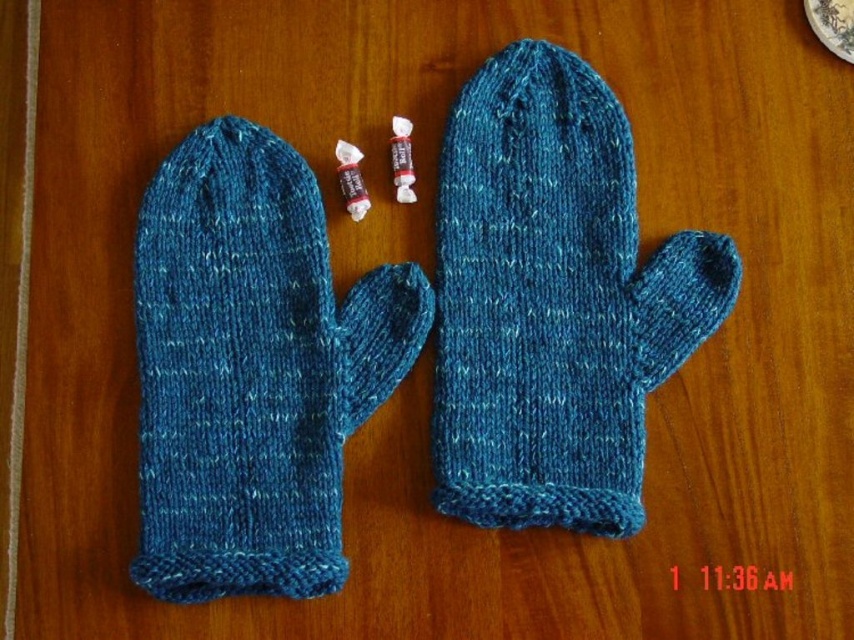
In the scene shown: Does teal knitted mitten at center have a lesser height compared to blue knitted mitten at left?

Incorrect, teal knitted mitten at center's height does not fall short of blue knitted mitten at left's.

Find the location of a particular element. teal knitted mitten at center is located at coordinates (553, 300).

The width and height of the screenshot is (854, 640). Describe the element at coordinates (553, 300) in the screenshot. I see `teal knitted mitten at center` at that location.

What are the coordinates of `teal knitted mitten at center` in the screenshot? It's located at (553, 300).